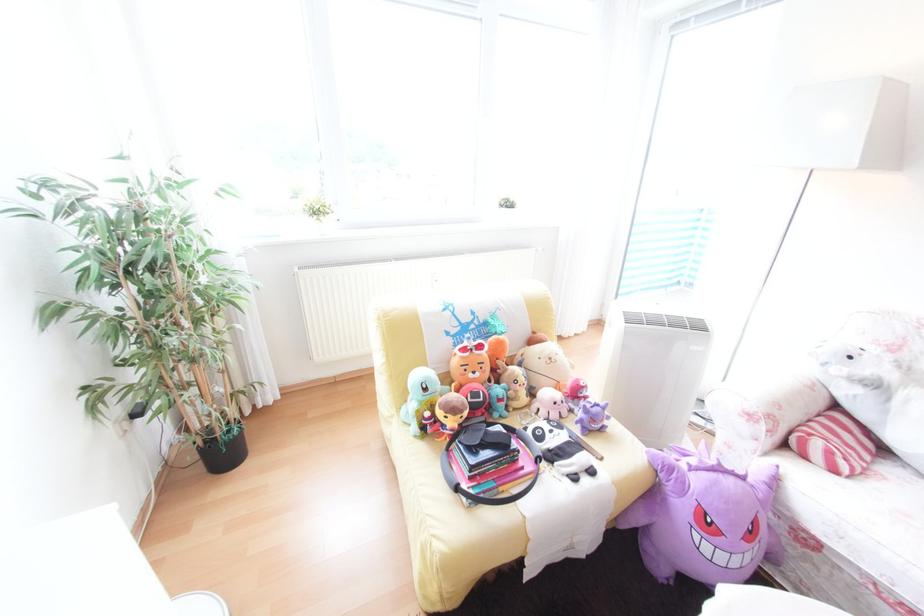
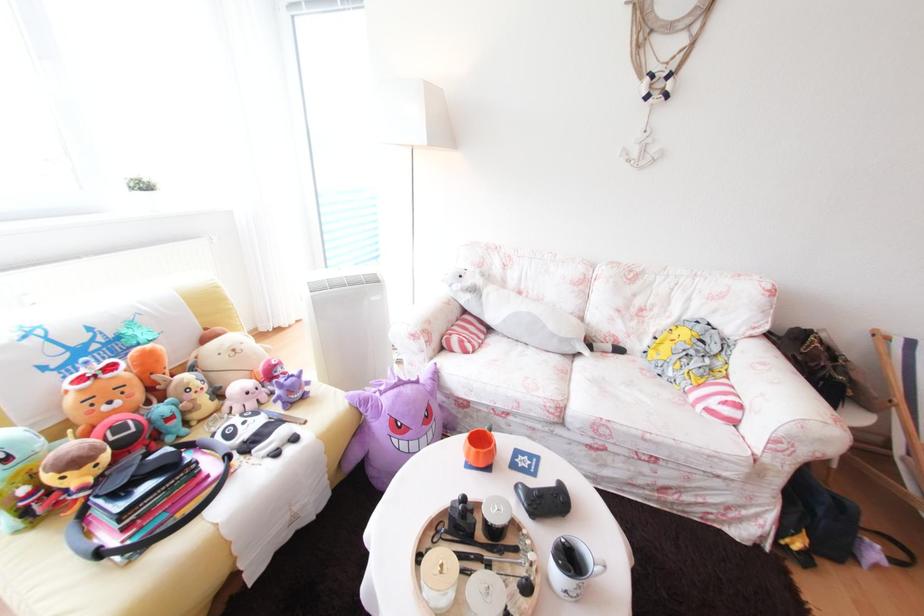
Question: Based on the continuous images, in which direction is the camera rotating? Reply with the corresponding letter.

Choices:
 (A) Left
 (B) Right
 (C) Up
 (D) Down

Answer: (B)